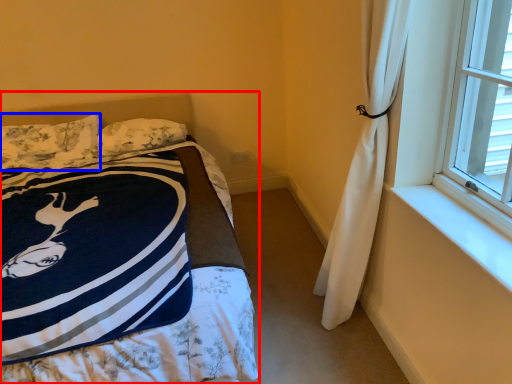
Question: Which object is further to the camera taking this photo, bed (highlighted by a red box) or pillow (highlighted by a blue box)?

Choices:
 (A) bed
 (B) pillow

Answer: (B)